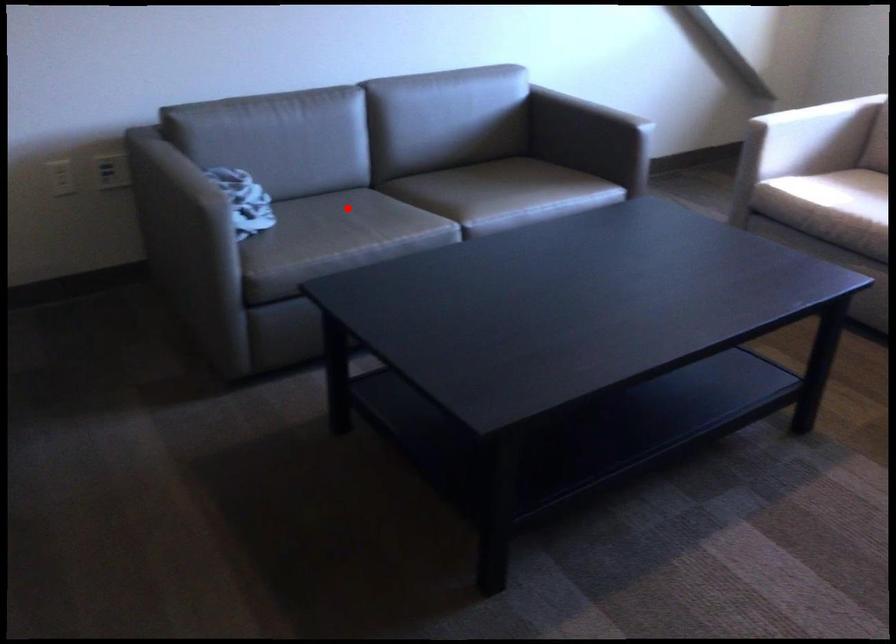
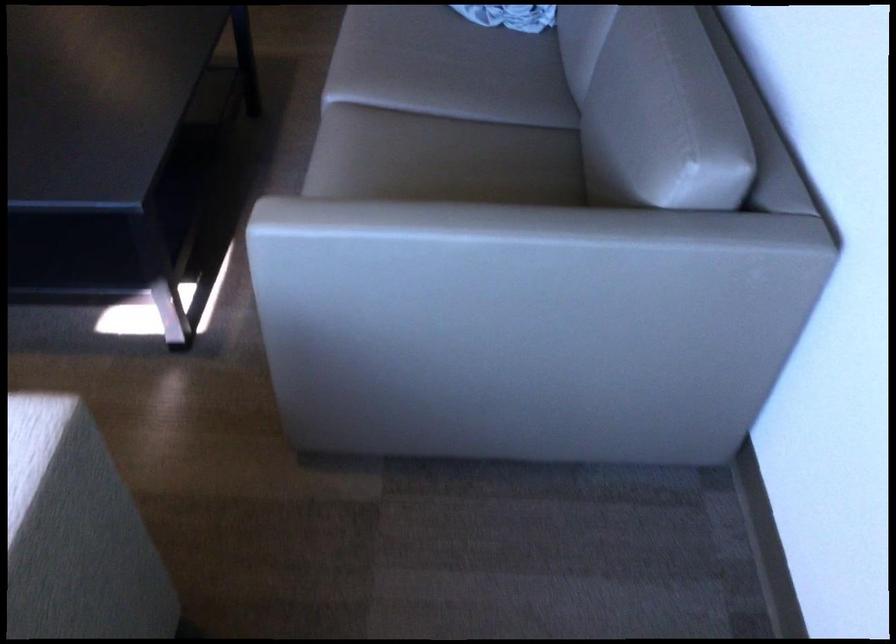
In the second image, find the point that corresponds to the highlighted location in the first image.

(463, 73)